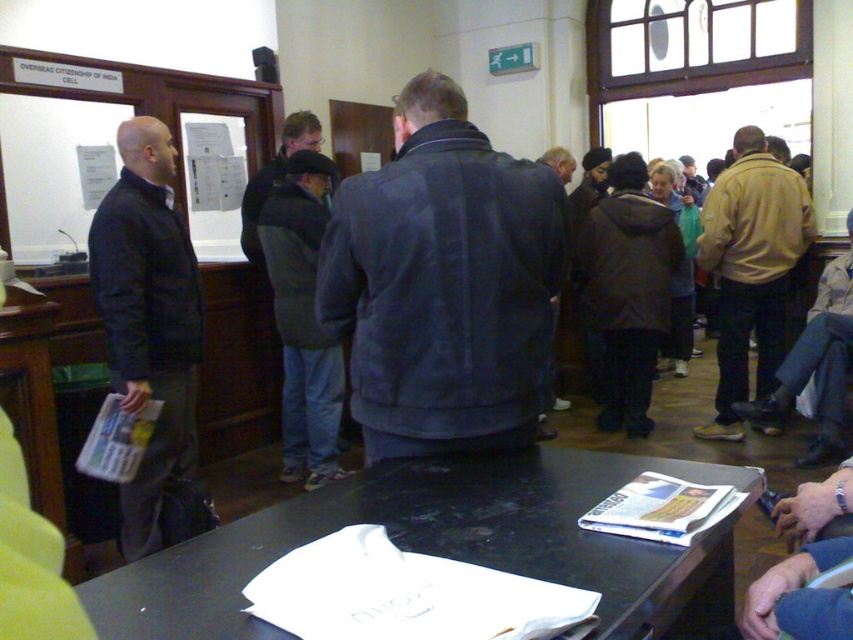
Who is more distant from viewer, [199,625] or [129,492]?

Point [129,492]

At what (x,y) coordinates should I click in order to perform the action: click on white paper at center. Please return your answer as a coordinate pair (x, y). The image size is (853, 640). Looking at the image, I should click on (448, 545).

Between dark blue leather jacket at center and white paper at center, which one has more height?

dark blue leather jacket at center is taller.

Does dark blue leather jacket at center have a greater width compared to white paper at center?

No, dark blue leather jacket at center is not wider than white paper at center.

Image resolution: width=853 pixels, height=640 pixels. Describe the element at coordinates (444, 284) in the screenshot. I see `dark blue leather jacket at center` at that location.

The width and height of the screenshot is (853, 640). Find the location of `dark blue leather jacket at center`. dark blue leather jacket at center is located at coordinates (444, 284).

Does point (369, 180) come closer to viewer compared to point (194, 420)?

Yes, point (369, 180) is in front of point (194, 420).

Is dark blue leather jacket at center smaller than dark blue jacket at left?

Yes.

Who is more distant from viewer, (x=416, y=352) or (x=206, y=522)?

The point (x=206, y=522) is behind.

Identify the location of dark blue leather jacket at center. (444, 284).